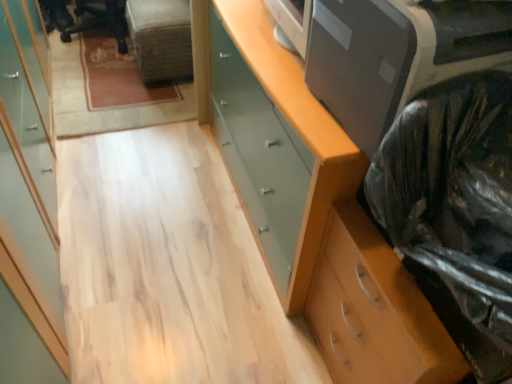
What do you see at coordinates (27, 217) in the screenshot? This screenshot has width=512, height=384. I see `light wood cabinet at left` at bounding box center [27, 217].

Measure the distance between black plastic bag at right and camera.

The distance of black plastic bag at right from camera is 22.73 inches.

At what (x,y) coordinates should I click in order to perform the action: click on matte green chest of drawers at right, the 2th chest of drawers in the bottom-to-top sequence. Please return your answer as a coordinate pair (x, y). The image size is (512, 384). Looking at the image, I should click on (316, 212).

This screenshot has width=512, height=384. What do you see at coordinates (100, 21) in the screenshot?
I see `black plastic chair at upper left` at bounding box center [100, 21].

Identify the location of light wood cabinet at left. (27, 217).

Between light wood cabinet at left and wooden chest of drawers at right, which is the 1th chest of drawers from bottom to top, which one is positioned behind?

wooden chest of drawers at right, which is the 1th chest of drawers from bottom to top, is behind.

Based on their sizes in the image, would you say light wood cabinet at left is bigger or smaller than wooden chest of drawers at right, which is the 1th chest of drawers from bottom to top?

light wood cabinet at left is bigger than wooden chest of drawers at right, which is the 1th chest of drawers from bottom to top.

Considering the positions of objects light wood cabinet at left and wooden chest of drawers at right, which is the second chest of drawers in top-to-bottom order, in the image provided, who is more to the right, light wood cabinet at left or wooden chest of drawers at right, which is the second chest of drawers in top-to-bottom order,?

wooden chest of drawers at right, which is the second chest of drawers in top-to-bottom order.

From the image's perspective, which is below, light wood cabinet at left or wooden chest of drawers at right, which is the second chest of drawers in top-to-bottom order?

wooden chest of drawers at right, which is the second chest of drawers in top-to-bottom order.

From the picture: Which object is closer to the camera taking this photo, satin gray printer at upper right or black plastic chair at upper left?

satin gray printer at upper right is in front.

Which of these two, satin gray printer at upper right or black plastic chair at upper left, stands taller?

black plastic chair at upper left.

Consider the image. Can you confirm if satin gray printer at upper right is positioned to the right of black plastic chair at upper left?

Yes, satin gray printer at upper right is to the right of black plastic chair at upper left.

Which of these two, black plastic chair at upper left or black plastic bag at right, is wider?

Wider between the two is black plastic chair at upper left.

From a real-world perspective, who is located higher, black plastic chair at upper left or black plastic bag at right?

black plastic bag at right.

From the image's perspective, between black plastic chair at upper left and black plastic bag at right, which one is located above?

black plastic chair at upper left appears higher in the image.

Which is behind, point (63, 29) or point (499, 235)?

The point (63, 29) is behind.

Which object is thinner, wooden chest of drawers at right, which is the 1th chest of drawers from bottom to top, or black plastic bag at right?

black plastic bag at right is thinner.

Which is farther from the camera, (x=386, y=322) or (x=428, y=149)?

Positioned behind is point (x=386, y=322).

In the image, is wooden chest of drawers at right, which is the 1th chest of drawers from bottom to top, positioned in front of or behind black plastic bag at right?

wooden chest of drawers at right, which is the 1th chest of drawers from bottom to top, is positioned farther from the viewer than black plastic bag at right.

From a real-world perspective, between wooden chest of drawers at right, which is the second chest of drawers in top-to-bottom order, and black plastic bag at right, who is vertically higher?

black plastic bag at right, from a real-world perspective.

Starting from the black plastic bag at right, which chest of drawers is the 2nd one behind? Please provide its 2D coordinates.

[(316, 212)]

Which of these two, matte green chest of drawers at right, which is counted as the first chest of drawers, starting from the top, or black plastic bag at right, is thinner?

With smaller width is black plastic bag at right.

Looking at the image, does matte green chest of drawers at right, which is counted as the first chest of drawers, starting from the top, seem bigger or smaller compared to black plastic bag at right?

matte green chest of drawers at right, which is counted as the first chest of drawers, starting from the top, is bigger than black plastic bag at right.

Is wooden chest of drawers at right, which is the 1th chest of drawers from bottom to top, positioned with its back to satin gray printer at upper right?

No, wooden chest of drawers at right, which is the 1th chest of drawers from bottom to top, is not facing away from satin gray printer at upper right.

Between point (366, 277) and point (388, 85), which one is positioned in front?

Point (388, 85)

Considering the relative sizes of wooden chest of drawers at right, which is the second chest of drawers in top-to-bottom order, and satin gray printer at upper right in the image provided, is wooden chest of drawers at right, which is the second chest of drawers in top-to-bottom order, bigger than satin gray printer at upper right?

Yes, wooden chest of drawers at right, which is the second chest of drawers in top-to-bottom order, is bigger than satin gray printer at upper right.

Is wooden chest of drawers at right, which is the second chest of drawers in top-to-bottom order, not close to satin gray printer at upper right?

No.

In the scene shown: From the image's perspective, is satin gray printer at upper right above wooden chest of drawers at right, which is the second chest of drawers in top-to-bottom order?

Yes, from the image's perspective, satin gray printer at upper right is on top of wooden chest of drawers at right, which is the second chest of drawers in top-to-bottom order.

Considering the sizes of objects satin gray printer at upper right and wooden chest of drawers at right, which is the 1th chest of drawers from bottom to top, in the image provided, who is taller, satin gray printer at upper right or wooden chest of drawers at right, which is the 1th chest of drawers from bottom to top,?

With more height is wooden chest of drawers at right, which is the 1th chest of drawers from bottom to top.

Could you tell me if satin gray printer at upper right is turned towards wooden chest of drawers at right, which is the second chest of drawers in top-to-bottom order?

No, satin gray printer at upper right does not turn towards wooden chest of drawers at right, which is the second chest of drawers in top-to-bottom order.

From a real-world perspective, which object stands above the other?

In real-world perspective, satin gray printer at upper right is above.

From the image's perspective, starting from the light wood cabinet at left, which chest of drawers is the 2nd one below? Please provide its 2D coordinates.

[(374, 310)]

Locate an element on the screen. This screenshot has width=512, height=384. computer chair located on the left of satin gray printer at upper right is located at coordinates (100, 21).

Looking at the image, which one is located closer to black plastic chair at upper left, satin gray printer at upper right or wooden chest of drawers at right, which is the 1th chest of drawers from bottom to top?

satin gray printer at upper right is positioned closer to the anchor black plastic chair at upper left.

Based on their spatial positions, is satin gray printer at upper right or black plastic chair at upper left further from light wood cabinet at left?

Based on the image, black plastic chair at upper left appears to be further to light wood cabinet at left.

Considering their positions, is matte green chest of drawers at right, which is counted as the first chest of drawers, starting from the top, positioned closer to satin gray printer at upper right than black plastic chair at upper left?

matte green chest of drawers at right, which is counted as the first chest of drawers, starting from the top, lies closer to satin gray printer at upper right than the other object.

From the image, which object appears to be farther from black plastic chair at upper left, matte green chest of drawers at right, which is counted as the first chest of drawers, starting from the top, or satin gray printer at upper right?

satin gray printer at upper right.

Based on their spatial positions, is black plastic bag at right or wooden chest of drawers at right, which is the second chest of drawers in top-to-bottom order, further from matte green chest of drawers at right, the 2th chest of drawers in the bottom-to-top sequence?

black plastic bag at right is positioned further to the anchor matte green chest of drawers at right, the 2th chest of drawers in the bottom-to-top sequence.

Based on their spatial positions, is light wood cabinet at left or satin gray printer at upper right further from wooden chest of drawers at right, which is the 1th chest of drawers from bottom to top?

light wood cabinet at left is further to wooden chest of drawers at right, which is the 1th chest of drawers from bottom to top.

Estimate the real-world distances between objects in this image. Which object is closer to satin gray printer at upper right, black plastic bag at right or matte green chest of drawers at right, the 2th chest of drawers in the bottom-to-top sequence?

black plastic bag at right lies closer to satin gray printer at upper right than the other object.

Based on their spatial positions, is black plastic chair at upper left or satin gray printer at upper right further from wooden chest of drawers at right, which is the second chest of drawers in top-to-bottom order?

Among the two, black plastic chair at upper left is located further to wooden chest of drawers at right, which is the second chest of drawers in top-to-bottom order.

Where is `cabinetry positioned between black plastic bag at right and black plastic chair at upper left from near to far`? The height and width of the screenshot is (384, 512). cabinetry positioned between black plastic bag at right and black plastic chair at upper left from near to far is located at coordinates (27, 217).

Where is `garbage situated between light wood cabinet at left and wooden chest of drawers at right, which is the second chest of drawers in top-to-bottom order, from left to right`? garbage situated between light wood cabinet at left and wooden chest of drawers at right, which is the second chest of drawers in top-to-bottom order, from left to right is located at coordinates (454, 193).

Locate an element on the screen. printer between light wood cabinet at left and black plastic chair at upper left in the front-back direction is located at coordinates (398, 54).

Find the location of a particular element. Image resolution: width=512 pixels, height=384 pixels. the chest of drawers situated between light wood cabinet at left and wooden chest of drawers at right, which is the second chest of drawers in top-to-bottom order, from left to right is located at coordinates (316, 212).